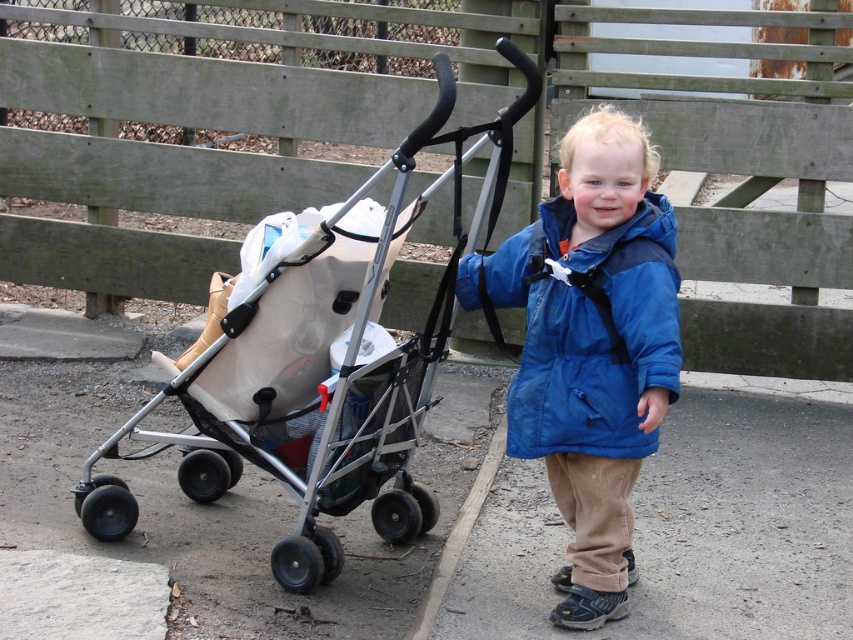
Is brown asphalt at lower right to the right of blue matte jacket at center from the viewer's perspective?

Correct, you'll find brown asphalt at lower right to the right of blue matte jacket at center.

Who is taller, brown asphalt at lower right or blue matte jacket at center?

With more height is blue matte jacket at center.

Identify the location of brown asphalt at lower right. This screenshot has width=853, height=640. (689, 524).

I want to click on brown asphalt at lower right, so click(689, 524).

Based on the photo, which is more to the right, silver metallic stroller at left or blue matte jacket at center?

blue matte jacket at center is more to the right.

Is silver metallic stroller at left above blue matte jacket at center?

No, silver metallic stroller at left is not above blue matte jacket at center.

Who is more distant from viewer, [251,296] or [590,381]?

The point [251,296] is more distant.

You are a GUI agent. You are given a task and a screenshot of the screen. Output one action in this format:
    pyautogui.click(x=<x>, y=<y>)
    Task: Click on the silver metallic stroller at left
    Image resolution: width=853 pixels, height=640 pixels.
    Given the screenshot: What is the action you would take?
    pyautogui.click(x=321, y=369)

Who is more forward, (422, 138) or (795, 636)?

Point (422, 138) is in front.

Identify the location of silver metallic stroller at left. The width and height of the screenshot is (853, 640). (321, 369).

Where is `silver metallic stroller at left`? silver metallic stroller at left is located at coordinates (321, 369).